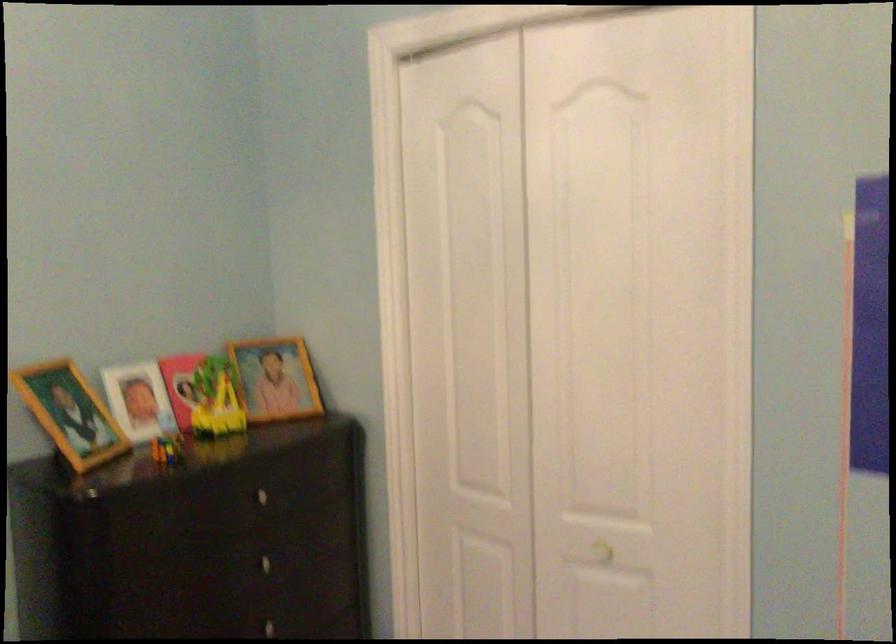
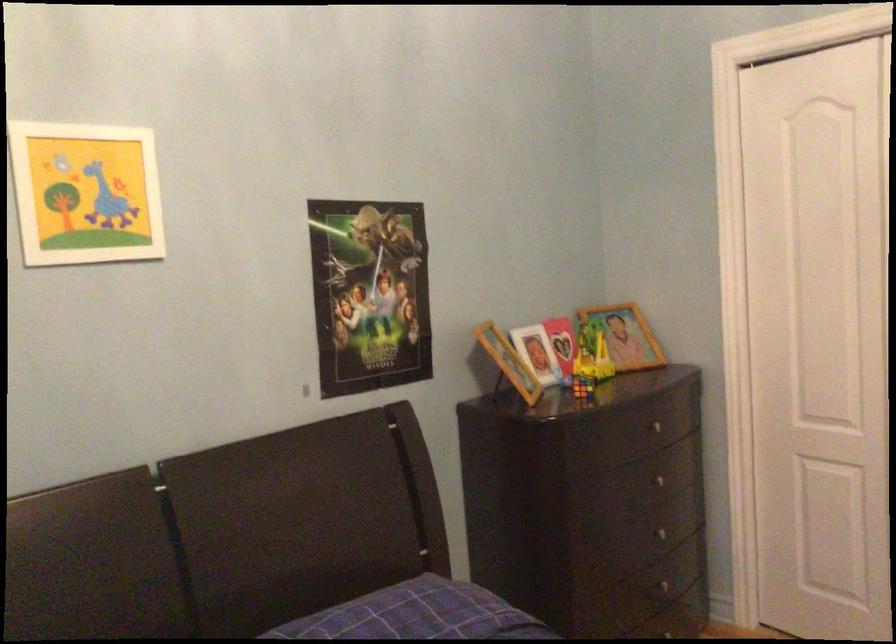
In the second image, find the point that corresponds to (x=161, y=446) in the first image.

(582, 386)